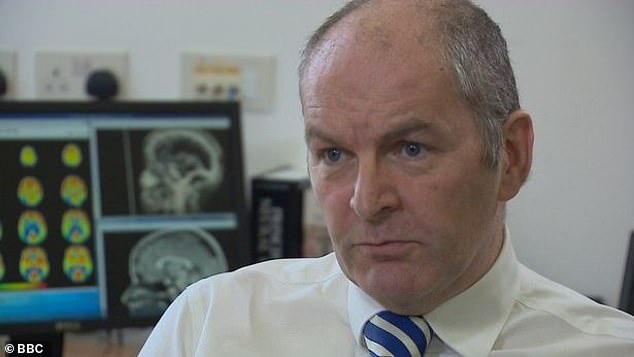
This screenshot has width=634, height=357. What are the coordinates of `computer monitor housing` in the screenshot? It's located at (104, 107).